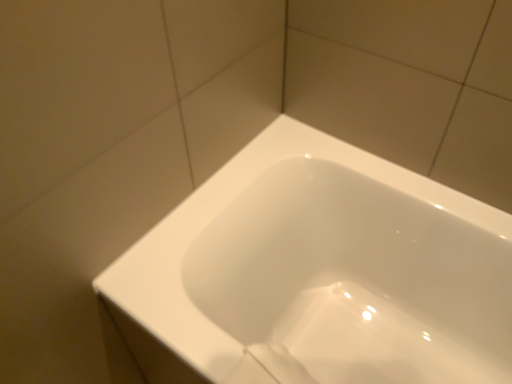
Image resolution: width=512 pixels, height=384 pixels. Describe the element at coordinates (325, 270) in the screenshot. I see `white glossy bathtub at center` at that location.

The width and height of the screenshot is (512, 384). Find the location of `white glossy bathtub at center`. white glossy bathtub at center is located at coordinates (325, 270).

You are a GUI agent. You are given a task and a screenshot of the screen. Output one action in this format:
    pyautogui.click(x=<x>, y=<y>)
    Task: Click on the white glossy bathtub at center
    
    Given the screenshot: What is the action you would take?
    pyautogui.click(x=325, y=270)